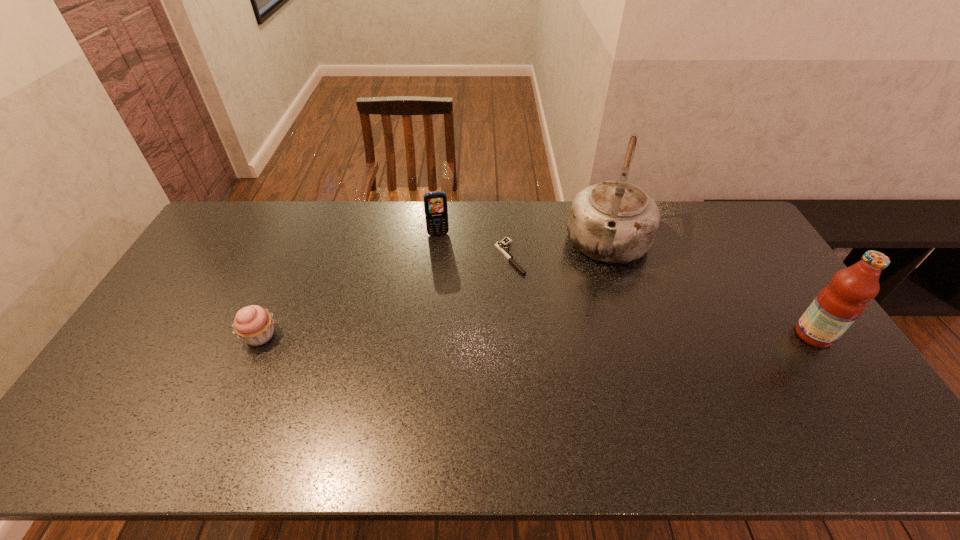
Find the location of a particular element. This screenshot has width=960, height=540. free location located 0.250m on the left of the leftmost object is located at coordinates (153, 336).

Locate an element on the screen. This screenshot has height=540, width=960. free space located at the spout of the tallest object is located at coordinates (588, 341).

The image size is (960, 540). What are the coordinates of `vacant point located at the spout of the tallest object` in the screenshot? It's located at (581, 375).

Where is `vacant position located at the spout of the tallest object`? The height and width of the screenshot is (540, 960). vacant position located at the spout of the tallest object is located at coordinates (601, 291).

Find the location of a particular element. The height and width of the screenshot is (540, 960). free space located 0.050m on the front-facing side of the shortest object is located at coordinates (528, 282).

Where is `vacant space located on the front-facing side of the shortest object`? vacant space located on the front-facing side of the shortest object is located at coordinates (578, 333).

Locate an element on the screen. Image resolution: width=960 pixels, height=540 pixels. vacant space located on the front-facing side of the shortest object is located at coordinates (540, 294).

Find the location of a particular element. The width and height of the screenshot is (960, 540). vacant space located 0.130m on the screen of the second object from left to right is located at coordinates (444, 261).

Find the location of a particular element. This screenshot has height=540, width=960. free space located 0.240m on the screen of the second object from left to right is located at coordinates (447, 285).

This screenshot has height=540, width=960. Find the location of `free space located on the screen of the second object from left to right`. free space located on the screen of the second object from left to right is located at coordinates (447, 280).